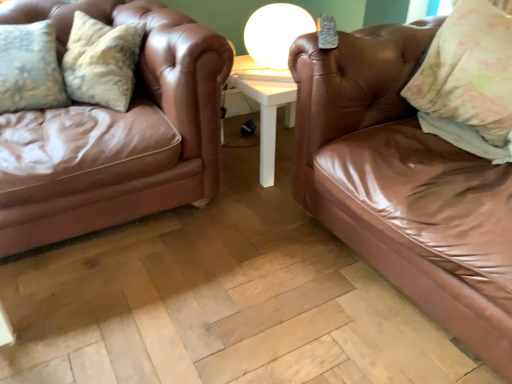
Question: Are floral fabric pillow at upper right and shiny brown leather couch at right, the 1th studio couch in the right-to-left sequence, located far from each other?

Choices:
 (A) yes
 (B) no

Answer: (B)

Question: Is the position of floral fabric pillow at upper right less distant than that of shiny brown leather couch at right, which is the 2th studio couch in left-to-right order?

Choices:
 (A) yes
 (B) no

Answer: (B)

Question: Considering the relative sizes of floral fabric pillow at upper right and shiny brown leather couch at right, the 1th studio couch in the right-to-left sequence, in the image provided, is floral fabric pillow at upper right taller than shiny brown leather couch at right, the 1th studio couch in the right-to-left sequence,?

Choices:
 (A) yes
 (B) no

Answer: (B)

Question: Is floral fabric pillow at upper right to the right of shiny brown leather couch at right, the 1th studio couch in the right-to-left sequence, from the viewer's perspective?

Choices:
 (A) yes
 (B) no

Answer: (A)

Question: Is floral fabric pillow at upper right positioned beyond the bounds of shiny brown leather couch at right, the 1th studio couch in the right-to-left sequence?

Choices:
 (A) yes
 (B) no

Answer: (B)

Question: In terms of height, does brown leather couch at left, which is the first studio couch in left-to-right order, look taller or shorter compared to floral fabric pillow at upper right?

Choices:
 (A) short
 (B) tall

Answer: (B)

Question: Is point (36, 167) closer or farther from the camera than point (493, 145)?

Choices:
 (A) closer
 (B) farther

Answer: (A)

Question: Considering the relative positions of brown leather couch at left, which is the second studio couch in right-to-left order, and floral fabric pillow at upper right in the image provided, is brown leather couch at left, which is the second studio couch in right-to-left order, to the left or to the right of floral fabric pillow at upper right?

Choices:
 (A) left
 (B) right

Answer: (A)

Question: In the image, is brown leather couch at left, which is the first studio couch in left-to-right order, positioned in front of or behind floral fabric pillow at upper right?

Choices:
 (A) front
 (B) behind

Answer: (A)

Question: From their relative heights in the image, would you say white glossy table lamp at upper center is taller or shorter than brown leather couch at left, which is the second studio couch in right-to-left order?

Choices:
 (A) short
 (B) tall

Answer: (A)

Question: Is white glossy table lamp at upper center inside the boundaries of brown leather couch at left, which is the first studio couch in left-to-right order, or outside?

Choices:
 (A) outside
 (B) inside

Answer: (A)

Question: Does point (250, 51) appear closer or farther from the camera than point (18, 114)?

Choices:
 (A) farther
 (B) closer

Answer: (A)

Question: Considering the positions of white glossy table lamp at upper center and brown leather couch at left, which is the second studio couch in right-to-left order, in the image, is white glossy table lamp at upper center bigger or smaller than brown leather couch at left, which is the second studio couch in right-to-left order,?

Choices:
 (A) big
 (B) small

Answer: (B)

Question: Visually, is brown leather couch at left, which is the second studio couch in right-to-left order, positioned to the left or to the right of white glossy table lamp at upper center?

Choices:
 (A) right
 (B) left

Answer: (B)

Question: Is point (151, 129) closer or farther from the camera than point (313, 26)?

Choices:
 (A) closer
 (B) farther

Answer: (A)